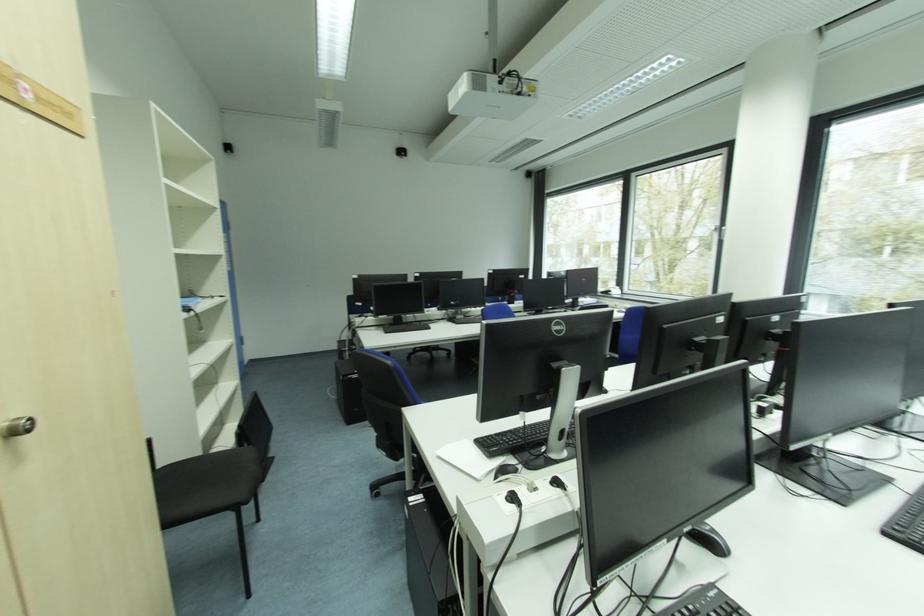
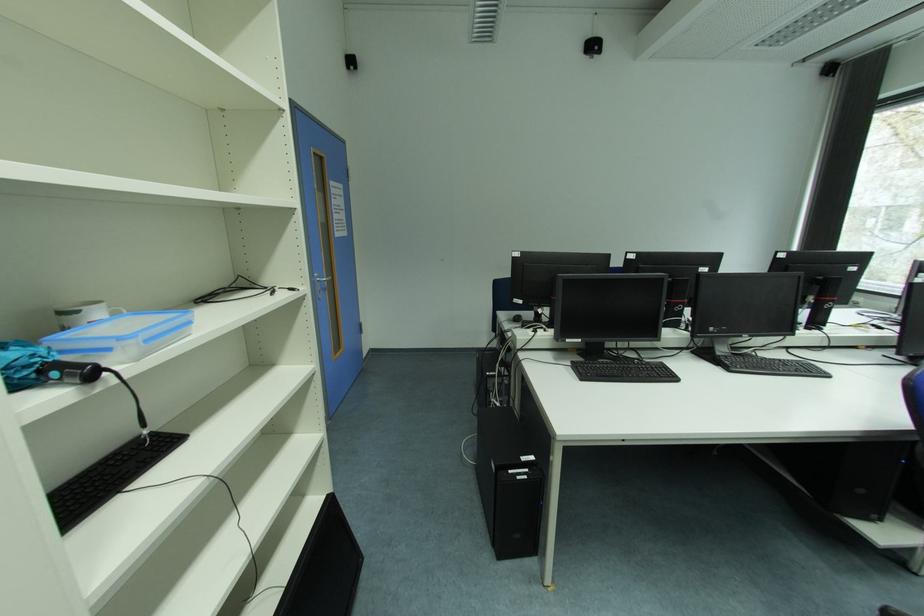
Which direction would the cameraman need to move to produce the second image?

The cameraman moved toward left, forward.